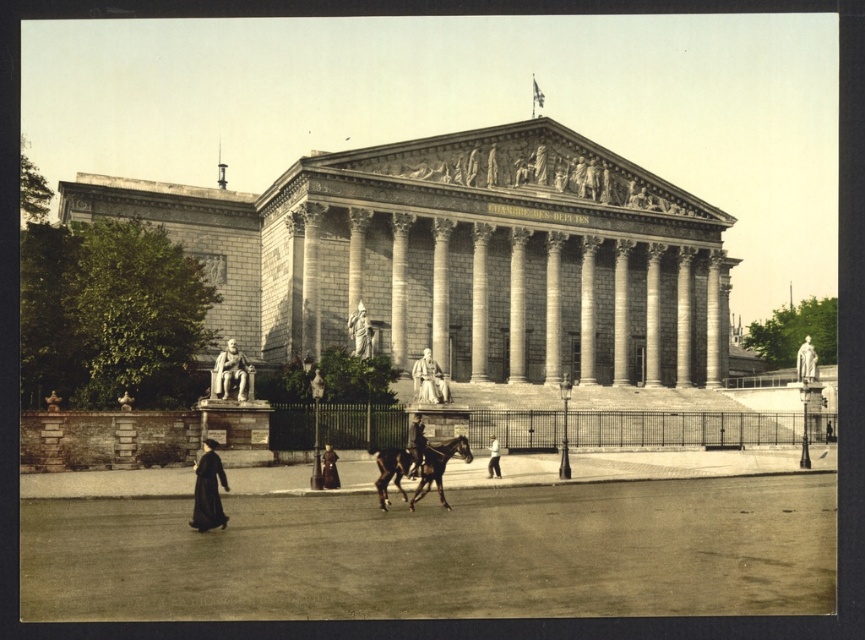
Question: Among these points, which one is farthest from the camera?

Choices:
 (A) (210, 468)
 (B) (646, 250)
 (C) (447, 388)

Answer: (B)

Question: Is gray stone column at center to the left of stone statue at center from the viewer's perspective?

Choices:
 (A) no
 (B) yes

Answer: (B)

Question: Is gray stone column at center positioned before dark brown leather coat at center?

Choices:
 (A) no
 (B) yes

Answer: (A)

Question: Is dark brown fabric coat at lower left above polished stone statue at center?

Choices:
 (A) no
 (B) yes

Answer: (A)

Question: Which is nearer to the polished stone statue at center?

Choices:
 (A) stone statue at left
 (B) gray stone column at center
 (C) brown glossy horse at center

Answer: (A)

Question: Estimate the real-world distances between objects in this image. Which object is farther from the dark brown fabric coat at lower left?

Choices:
 (A) smooth leather jacket at center
 (B) stone statue at left
 (C) light beige fabric coat at center
 (D) polished stone statue at center

Answer: (C)